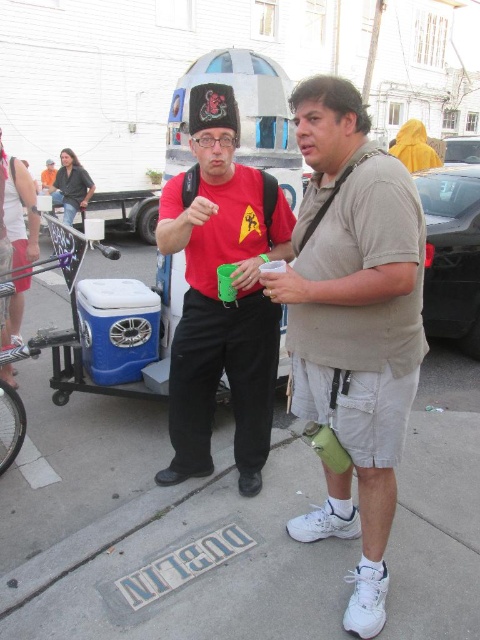
Does concrete sidewalk at center appear over matte red shirt at center?

No, concrete sidewalk at center is not above matte red shirt at center.

The image size is (480, 640). I want to click on concrete sidewalk at center, so click(x=156, y=531).

Between point (239, 419) and point (54, 336), which one is positioned in front?

Point (239, 419) is more forward.

Can you confirm if matte red shirt at center is shorter than blue plastic cooler at center?

In fact, matte red shirt at center may be taller than blue plastic cooler at center.

Which is in front, point (233, 348) or point (44, 340)?

Positioned in front is point (233, 348).

This screenshot has width=480, height=640. Identify the location of matte red shirt at center. (217, 296).

Is concrete sidewalk at center taller than green fabric water bottle at center?

In fact, concrete sidewalk at center may be shorter than green fabric water bottle at center.

Is concrete sidewalk at center positioned behind green fabric water bottle at center?

Yes, concrete sidewalk at center is further from the viewer.

What do you see at coordinates (156, 531) in the screenshot?
I see `concrete sidewalk at center` at bounding box center [156, 531].

Locate an element on the screen. Image resolution: width=480 pixels, height=640 pixels. concrete sidewalk at center is located at coordinates (156, 531).